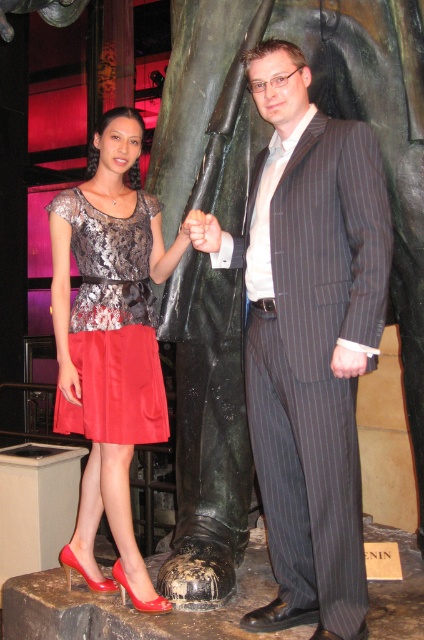
You are a photographer trying to capture a clear shot of both the striped pinstripe suit at center and the smooth skin hand at center. Since you want to ensure both are in focus, you need to know their relative sizes. Which object is bigger?

The striped pinstripe suit at center is larger than the smooth skin hand at center.

You are a photographer trying to adjust the lighting for a photo shoot. You notice the smooth skin hand at center and the satin red dress at center. Which object is closer to the camera lens?

The smooth skin hand at center is behind the satin red dress at center, so the satin red dress at center is closer to the camera lens.

You are a photographer setting up a shot for two people. The woman is wearing a satin red dress at center and the man has a smooth skin hand at center. You need to ensure the dress is visible in the photo. Considering their sizes, which object should be placed closer to the camera to ensure visibility?

The satin red dress at center is bigger than the smooth skin hand at center, so placing the dress closer to the camera will ensure it remains visible while the smaller hand may still be in frame but less prominent.